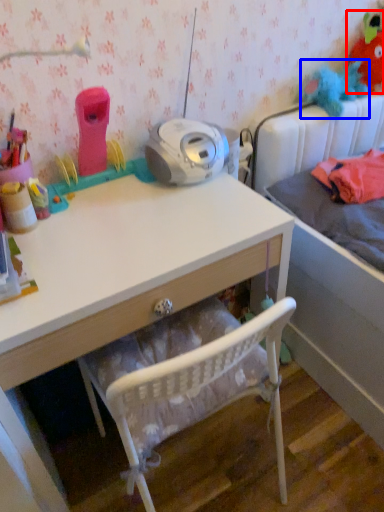
Question: Which of the following is the closest to the observer, toy (highlighted by a red box) or toy (highlighted by a blue box)?

Choices:
 (A) toy
 (B) toy

Answer: (B)